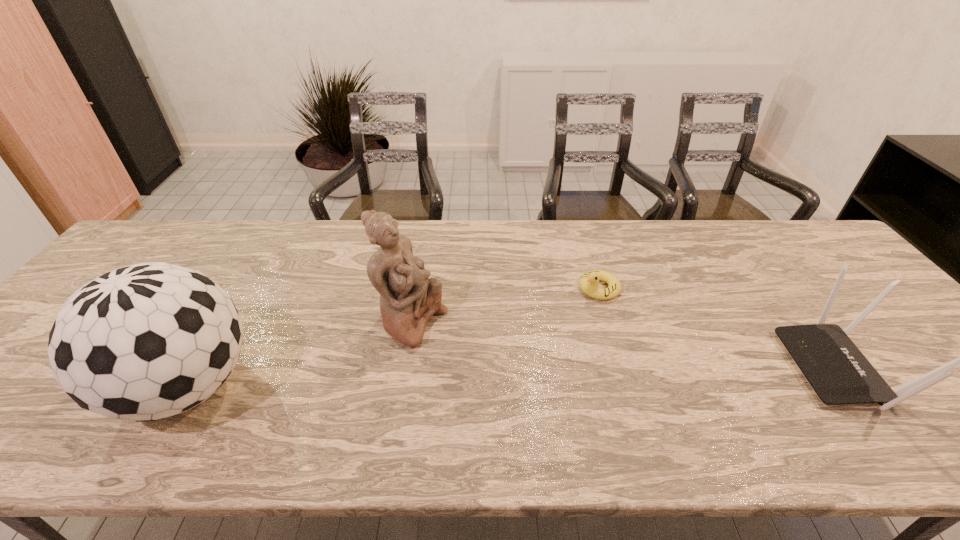
What are the coordinates of `free region located 0.220m on the face of the shortest object` in the screenshot? It's located at (525, 334).

The height and width of the screenshot is (540, 960). Identify the location of free spot located on the face of the shortest object. (513, 342).

Identify the location of vacant space located on the face of the shortest object. (474, 366).

Find the location of a particular element. The height and width of the screenshot is (540, 960). vacant area situated on the front-facing side of the second object from left to right is located at coordinates pos(538,380).

This screenshot has height=540, width=960. I want to click on free space located on the front-facing side of the second object from left to right, so click(541, 382).

Find the location of a particular element. free point located on the front-facing side of the second object from left to right is located at coordinates (510, 368).

Identify the location of soccer ball situated at the near edge. The image size is (960, 540). (143, 342).

You are a GUI agent. You are given a task and a screenshot of the screen. Output one action in this format:
    pyautogui.click(x=<x>, y=<y>)
    Task: Click on the router at the near edge
    This screenshot has width=960, height=540.
    Given the screenshot: What is the action you would take?
    pyautogui.click(x=838, y=372)

This screenshot has height=540, width=960. Find the location of `object at the right edge`. object at the right edge is located at coordinates (838, 372).

Where is `object that is at the near right corner`? The image size is (960, 540). object that is at the near right corner is located at coordinates (838, 372).